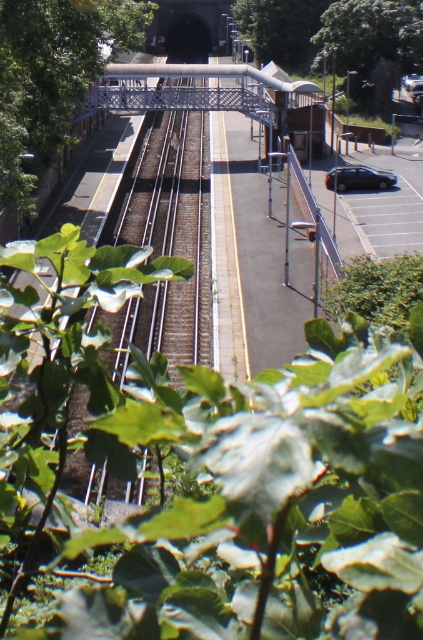
You are standing on the elevated bridge in the railway station scene. You notice two points marked as point 1 and point 2. Point 1 is located at coordinates point (371, 65) and point 2 is at point (327, 182). If you want to reach the point closer to the camera first, which point should you head towards?

You should head towards point (371, 65) because it is closer to the camera compared to point (327, 182).

You are standing on the pedestrian bridge and want to take a photo of both the green leafy tree at left and the satin black car at right. Which object should you position closer to the camera to ensure both are in focus?

To ensure both the green leafy tree at left and the satin black car at right are in focus, position the green leafy tree at left closer to the camera since it is in front of the satin black car at right.

You are standing at the point marked as point (52,76) in the image. What can you see immediately around you?

You are on a green leafy tree at left, so you can see the surrounding green foliage and the railway tracks extending towards the tunnel entrance in the distance.